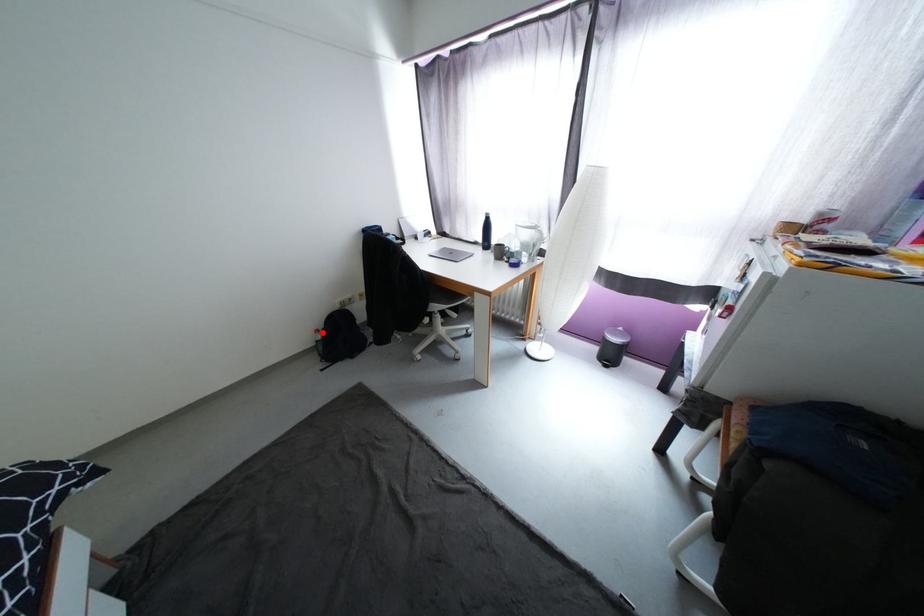
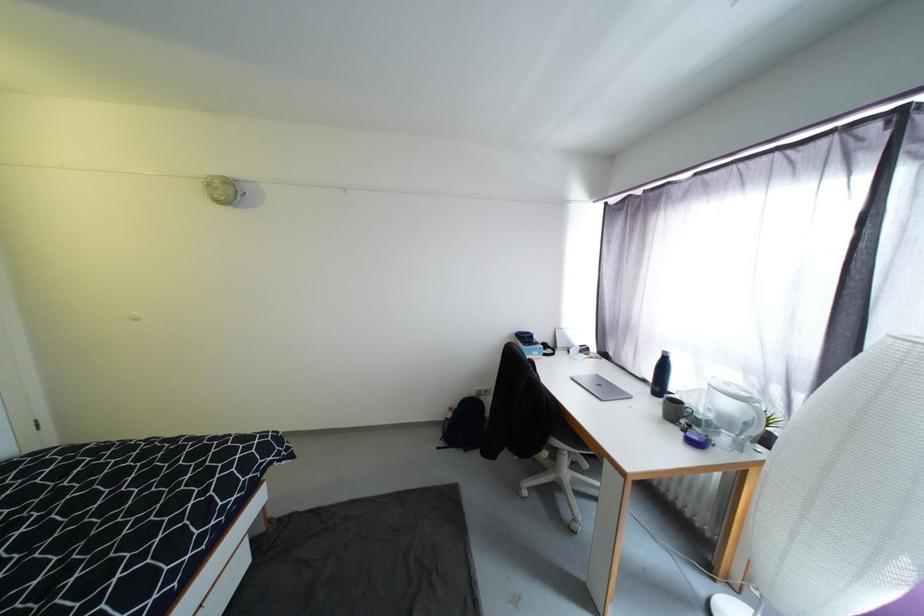
The point at the highlighted location is marked in the first image. Where is the corresponding point in the second image?

(456, 410)